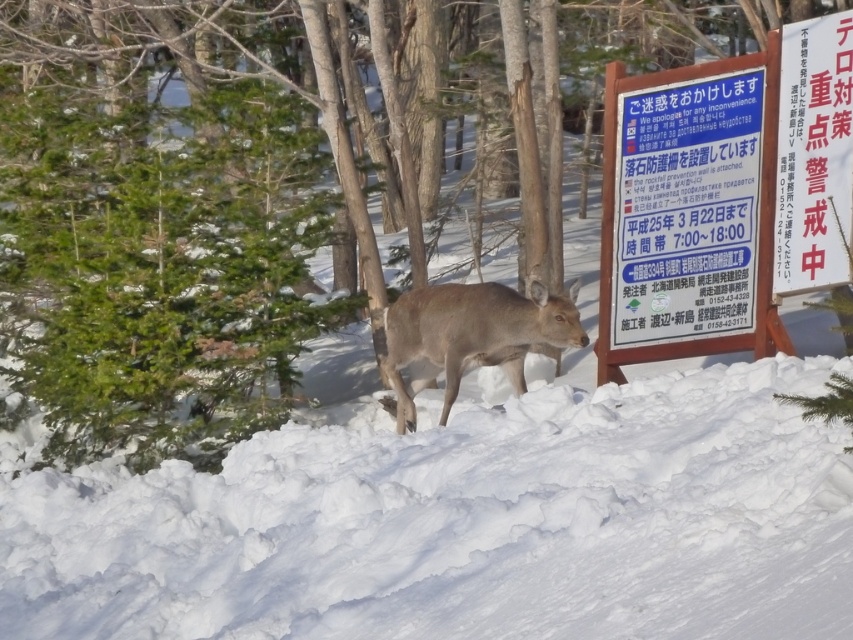
You are an animal tracker observing the winter forest scene. You notice the white fluffy snow at center and the brown matte deer at center. Which object occupies a smaller area in the image?

The white fluffy snow at center has a lesser width compared to the brown matte deer at center, so the white fluffy snow at center occupies a smaller area.

You are an animal tracker observing the winter forest scene. You notice the brown matte deer at center and the white fluffy snow at center. Based on their positions, can you determine which object is located to the right of the other?

The white fluffy snow at center is to the right of brown matte deer at center.

You are standing in the winter forest scene and want to place a small red flag at each of the two points labeled point (848, 163) and point (517, 333). Which point will have its flag closer to you?

Point (848, 163) is closer to the camera than point (517, 333), so the flag placed at point (848, 163) will be closer to you.